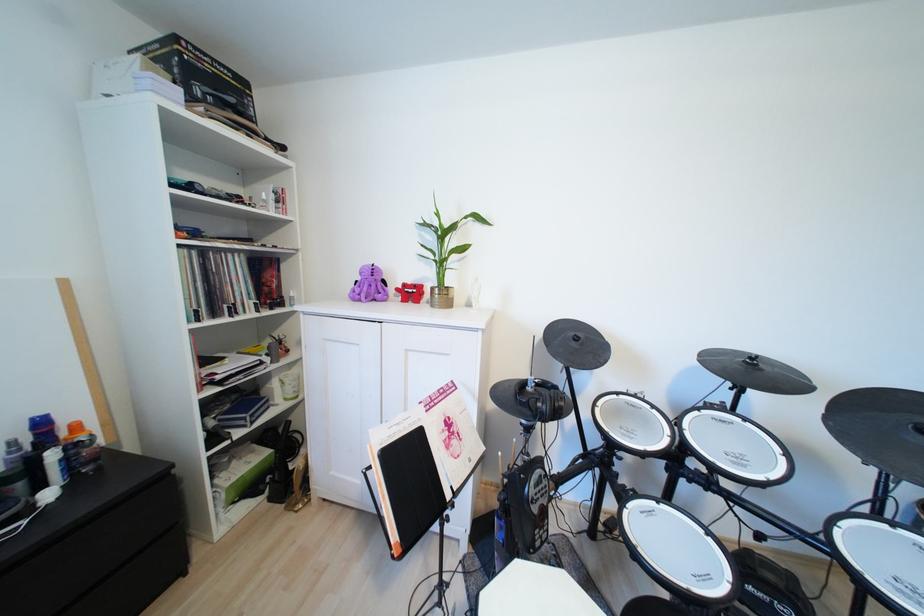
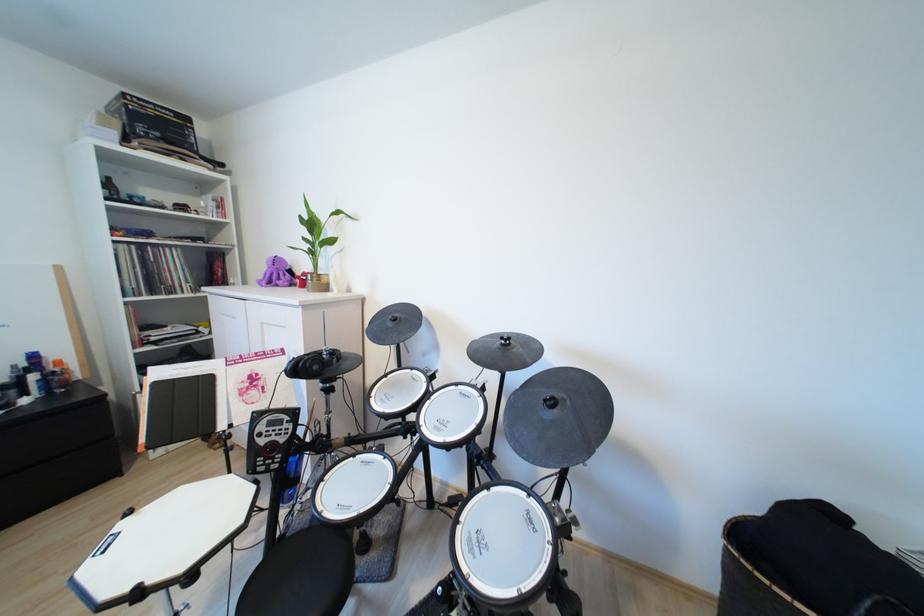
In the second image, find the point that corresponds to [625,395] in the first image.

(419, 370)